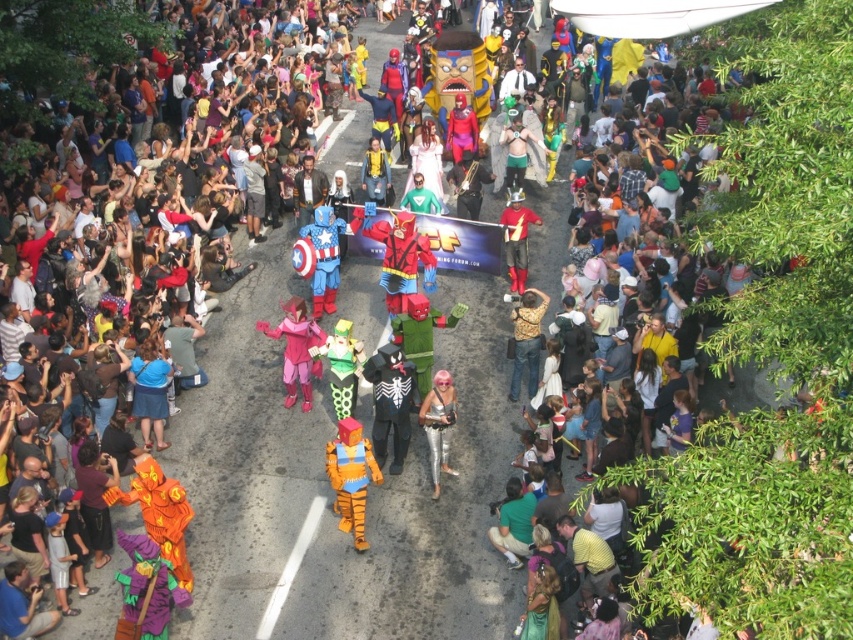
Is point (325, 225) more distant than point (527, 356)?

Yes, it is behind point (527, 356).

Does blue matte captain america costume at center come in front of gold metallic jacket at center?

No, it is not.

This screenshot has width=853, height=640. Describe the element at coordinates (323, 257) in the screenshot. I see `blue matte captain america costume at center` at that location.

At what (x,y) coordinates should I click in order to perform the action: click on blue matte captain america costume at center. Please return your answer as a coordinate pair (x, y). This screenshot has width=853, height=640. Looking at the image, I should click on (323, 257).

The width and height of the screenshot is (853, 640). Describe the element at coordinates (351, 476) in the screenshot. I see `orange fabric tiger at center` at that location.

What do you see at coordinates (351, 476) in the screenshot?
I see `orange fabric tiger at center` at bounding box center [351, 476].

Find the location of `orange fabric tiger at center`. orange fabric tiger at center is located at coordinates (351, 476).

What do you see at coordinates (351, 476) in the screenshot?
I see `orange fabric tiger at center` at bounding box center [351, 476].

Is orange fabric tiger at center smaller than shiny metallic costume at center?

No.

I want to click on orange fabric tiger at center, so click(x=351, y=476).

What are the coordinates of `orange fabric tiger at center` in the screenshot? It's located at (351, 476).